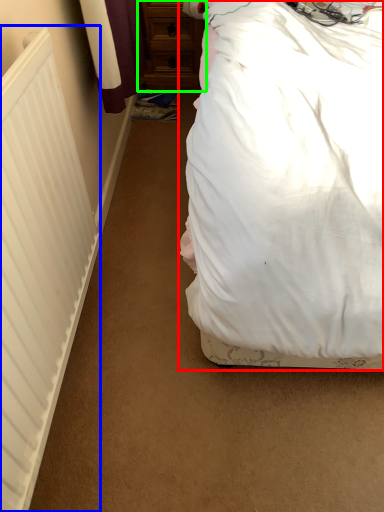
Question: Which object is the closest to the bed (highlighted by a red box)? Choose among these: radiator (highlighted by a blue box) or chest of drawers (highlighted by a green box).

Choices:
 (A) radiator
 (B) chest of drawers

Answer: (A)